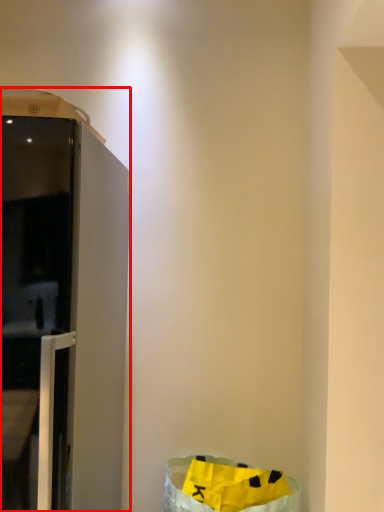
Question: From the image's perspective, where is furniture (annotated by the red box) located in relation to recycling bin in the image?

Choices:
 (A) below
 (B) above

Answer: (B)